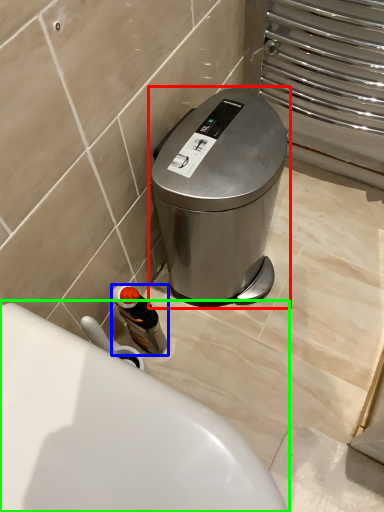
Question: Estimate the real-world distances between objects in this image. Which object is farther from waste container (highlighted by a red box), bottle (highlighted by a blue box) or toilet (highlighted by a green box)?

Choices:
 (A) bottle
 (B) toilet

Answer: (B)